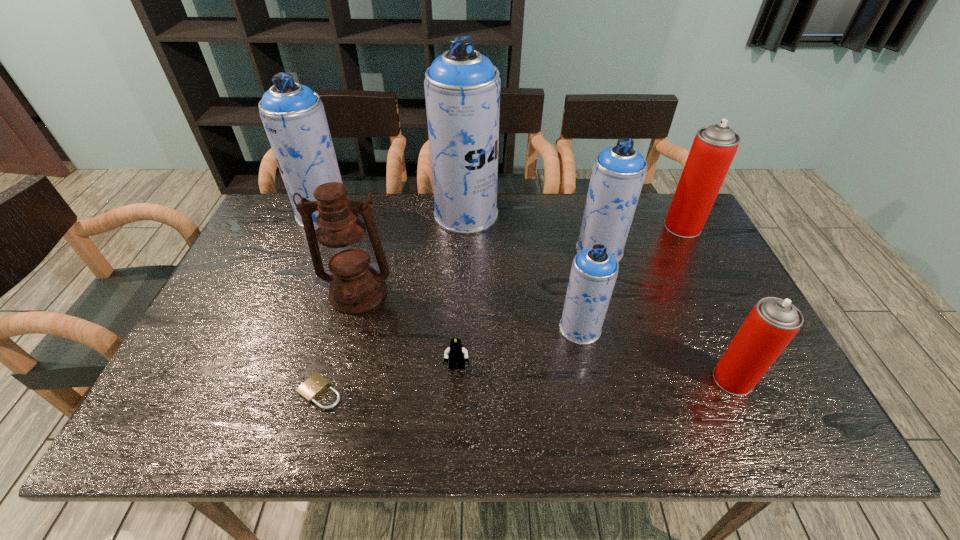
Where is `free space between the oil lamp and the biggest blue aerosol can`? The width and height of the screenshot is (960, 540). free space between the oil lamp and the biggest blue aerosol can is located at coordinates (412, 254).

This screenshot has width=960, height=540. In order to click on free space between the nearest aerosol can and the beige padlock in this screenshot , I will do `click(526, 386)`.

Locate an element on the screen. Image resolution: width=960 pixels, height=540 pixels. vacant point located between the third smallest blue aerosol can and the nearest aerosol can is located at coordinates (528, 297).

This screenshot has height=540, width=960. I want to click on free spot between the second nearest aerosol can and the black Lego, so click(518, 348).

Where is `free point between the smaller red aerosol can and the smallest blue aerosol can`? free point between the smaller red aerosol can and the smallest blue aerosol can is located at coordinates (657, 354).

This screenshot has width=960, height=540. What are the coordinates of `object that ranks as the fourth closest to the beige padlock` in the screenshot? It's located at (293, 115).

Point out which object is positioned as the fifth nearest to the smallest blue aerosol can. Please provide its 2D coordinates. Your answer should be formatted as a tuple, i.e. [(x, y)], where the tuple contains the x and y coordinates of a point satisfying the conditions above.

[(714, 147)]

Select which aerosol can is the third closest to the smallest blue aerosol can. Please provide its 2D coordinates. Your answer should be formatted as a tuple, i.e. [(x, y)], where the tuple contains the x and y coordinates of a point satisfying the conditions above.

[(462, 87)]

Image resolution: width=960 pixels, height=540 pixels. I want to click on aerosol can identified as the second closest to the farther red aerosol can, so click(594, 271).

This screenshot has width=960, height=540. Find the location of `blue aerosol can that is the third closest to the tallest object`. blue aerosol can that is the third closest to the tallest object is located at coordinates (594, 271).